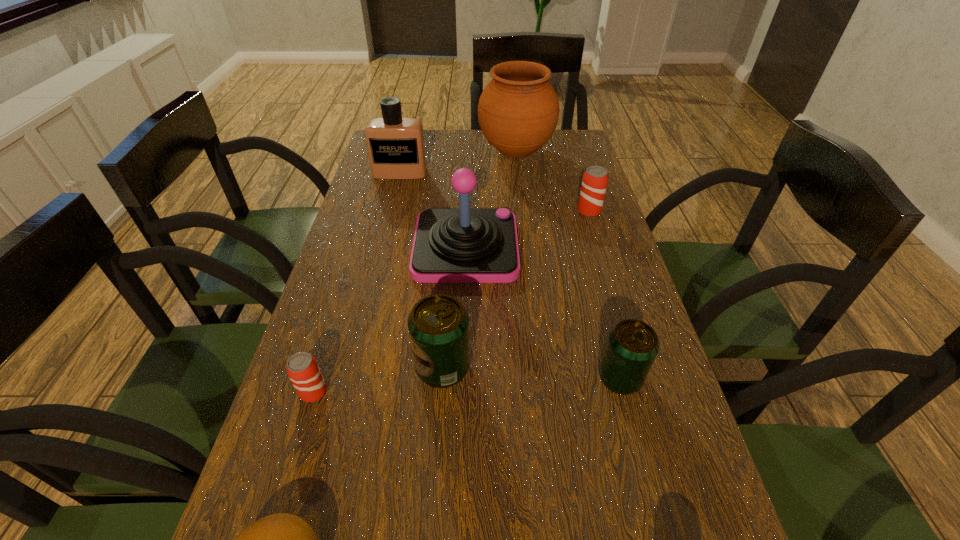
Identify the location of pottery present at the right edge. This screenshot has width=960, height=540. (518, 111).

Find the location of a particular element. object that is at the far right corner is located at coordinates (518, 111).

Identify the location of vacant space at the far edge of the desktop. This screenshot has width=960, height=540. (433, 135).

Find the location of a particular element. The image size is (960, 540). blank area at the left edge is located at coordinates (390, 215).

I want to click on vacant point at the right edge, so click(588, 288).

Where is `vacant point at the far right corner`? The width and height of the screenshot is (960, 540). vacant point at the far right corner is located at coordinates (549, 163).

Identify the location of free space between the joystick and the pottery. (491, 199).

The image size is (960, 540). In order to click on object that can be found as the second closest to the beige perfume in this screenshot , I will do `click(464, 245)`.

Select which object is the third closest to the pink joystick. Please provide its 2D coordinates. Your answer should be formatted as a tuple, i.e. [(x, y)], where the tuple contains the x and y coordinates of a point satisfying the conditions above.

[(395, 144)]

This screenshot has height=540, width=960. Find the location of `beer can that stands as the third closest to the joystick`. beer can that stands as the third closest to the joystick is located at coordinates (632, 345).